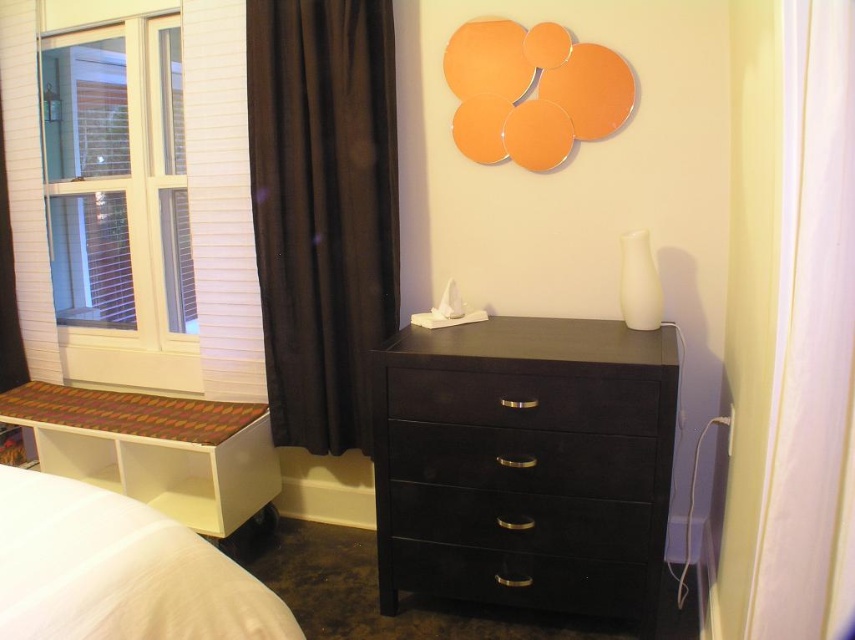
What are the coordinates of the matte black dresser at center?

The coordinates of the matte black dresser at center are point (525, 465).

You are standing in the bedroom and want to move from the white soft bed at lower left to the window. The matte black dresser at center is in your way. Can you walk around it to reach the window?

The white soft bed at lower left is behind matte black dresser at center, so you can walk around the matte black dresser at center to reach the window.

You are trying to decide whether to place a rectangular decorative item on the matte black dresser at center or the black matte drawer at center. Based on their widths, which one can accommodate a wider object?

The matte black dresser at center is wider than the black matte drawer at center, so it can accommodate a wider object.